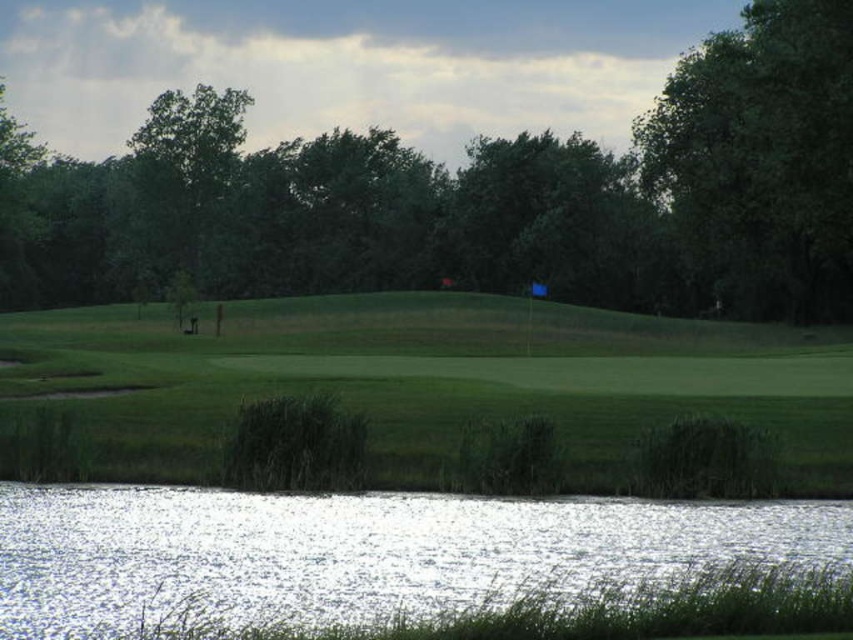
Can you confirm if green leafy tree at center is positioned to the right of green grassy hill at center?

Correct, you'll find green leafy tree at center to the right of green grassy hill at center.

Can you confirm if green leafy tree at center is taller than green grassy hill at center?

Yes, green leafy tree at center is taller than green grassy hill at center.

Is point (16, 170) closer to viewer compared to point (321, 304)?

No, (16, 170) is behind (321, 304).

Locate an element on the screen. The width and height of the screenshot is (853, 640). green leafy tree at center is located at coordinates (456, 188).

In the scene shown: Does green grassy hill at center have a larger size compared to green leafy tree at upper right?

No, green grassy hill at center is not bigger than green leafy tree at upper right.

Does green grassy hill at center have a greater width compared to green leafy tree at upper right?

Yes.

Describe the element at coordinates (440, 378) in the screenshot. I see `green grassy hill at center` at that location.

Where is `green grassy hill at center`? The width and height of the screenshot is (853, 640). green grassy hill at center is located at coordinates (440, 378).

The image size is (853, 640). What are the coordinates of `green grassy hill at center` in the screenshot? It's located at (440, 378).

Does green grassy hill at center have a smaller size compared to clear water at lower left?

Incorrect, green grassy hill at center is not smaller in size than clear water at lower left.

Does point (281, 371) come farther from viewer compared to point (529, 550)?

Yes, point (281, 371) is farther from viewer.

Identify the location of green grassy hill at center. (440, 378).